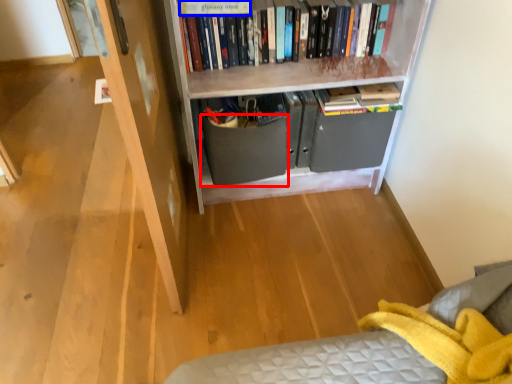
Question: Which of the following is the closest to the observer, drawer (highlighted by a red box) or paperback book (highlighted by a blue box)?

Choices:
 (A) drawer
 (B) paperback book

Answer: (B)